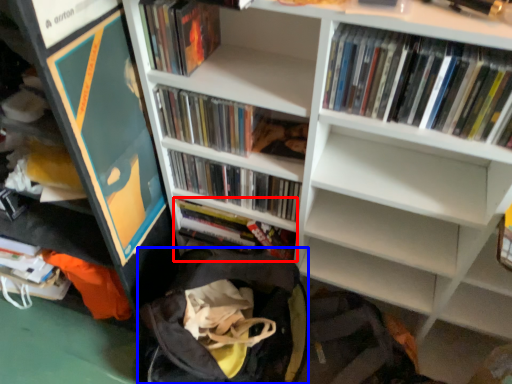
Question: Which object appears farthest to the camera in this image, book (highlighted by a red box) or backpack (highlighted by a blue box)?

Choices:
 (A) book
 (B) backpack

Answer: (A)